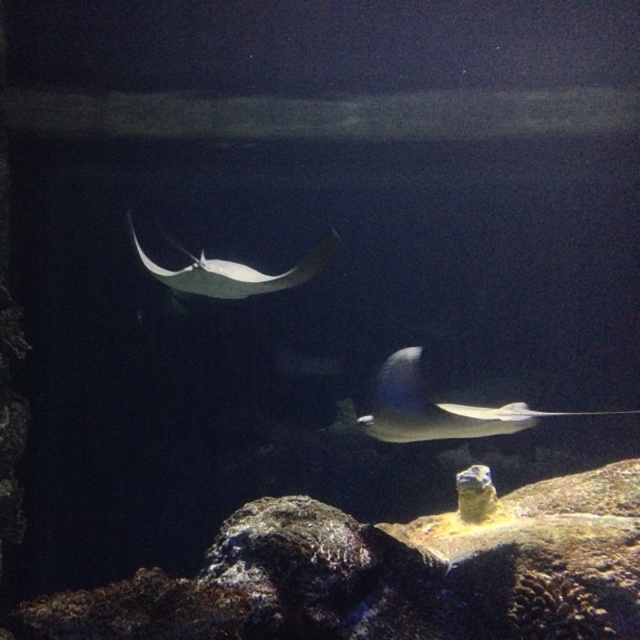
Question: Is glossy blue stingray at center to the right of white glossy stingray at center from the viewer's perspective?

Choices:
 (A) yes
 (B) no

Answer: (A)

Question: Where is glossy blue stingray at center located in relation to white glossy stingray at center in the image?

Choices:
 (A) left
 (B) right

Answer: (B)

Question: Does glossy blue stingray at center have a smaller size compared to white glossy stingray at center?

Choices:
 (A) yes
 (B) no

Answer: (A)

Question: Which point is closer to the camera?

Choices:
 (A) white glossy stingray at center
 (B) glossy blue stingray at center

Answer: (B)

Question: Among these points, which one is nearest to the camera?

Choices:
 (A) (371, 428)
 (B) (164, 236)

Answer: (A)